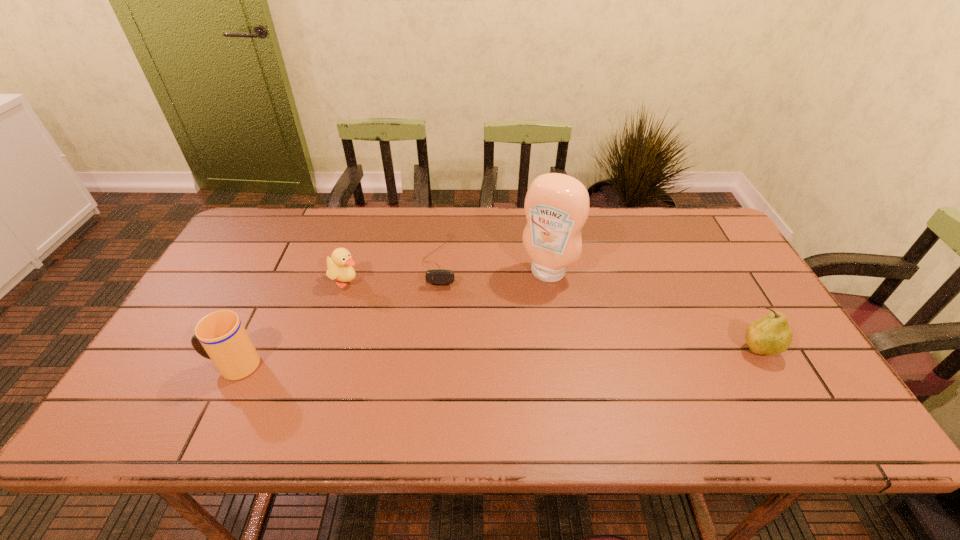
Image resolution: width=960 pixels, height=540 pixels. In order to click on vacant space situated 0.070m on the back of the rightmost object in this screenshot , I will do `click(740, 317)`.

I want to click on free space located on the label of the second object from right to left, so click(x=480, y=373).

Where is `free space located 0.250m on the label of the second object from right to left`? free space located 0.250m on the label of the second object from right to left is located at coordinates (497, 347).

Locate an element on the screen. vacant space located 0.190m on the label of the second object from right to left is located at coordinates (507, 330).

Image resolution: width=960 pixels, height=540 pixels. Identify the location of free space located on the front-facing side of the shortest object. (420, 394).

Locate an element on the screen. free point located 0.050m on the front-facing side of the shortest object is located at coordinates (435, 302).

What are the coordinates of `vacant space located on the front-facing side of the shortest object` in the screenshot? It's located at (427, 348).

Where is `vacant space positioned 0.090m on the front-facing side of the duckling`? The height and width of the screenshot is (540, 960). vacant space positioned 0.090m on the front-facing side of the duckling is located at coordinates (383, 297).

Locate an element on the screen. This screenshot has height=540, width=960. vacant space located 0.360m on the front-facing side of the duckling is located at coordinates (465, 336).

Find the location of a particular element. vacant region located 0.130m on the front-facing side of the duckling is located at coordinates (395, 302).